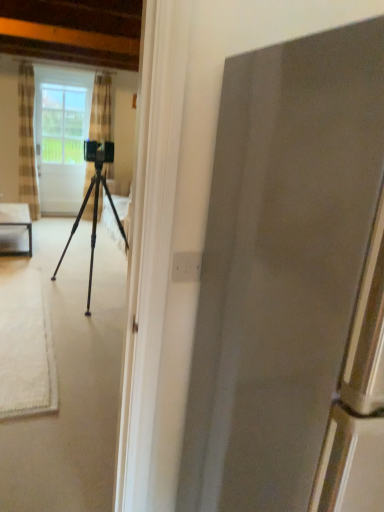
Measure the distance between point (19, 206) and camera.

Point (19, 206) and camera are 4.71 meters apart.

The height and width of the screenshot is (512, 384). Describe the element at coordinates (27, 140) in the screenshot. I see `checkered fabric curtain at left, the second curtain from the right` at that location.

The width and height of the screenshot is (384, 512). In order to click on striped fabric curtain at center, which ranks as the 1th curtain in right-to-left order in this screenshot , I will do `click(101, 109)`.

From the image's perspective, between checkered fabric curtain at left, the second curtain from the right, and clear glass table at left, who is located below?

clear glass table at left.

Consider the image. Is the surface of checkered fabric curtain at left, the 1th curtain positioned from the left, in direct contact with clear glass table at left?

No, checkered fabric curtain at left, the 1th curtain positioned from the left, is not making contact with clear glass table at left.

Is checkered fabric curtain at left, the 1th curtain positioned from the left, wider or thinner than clear glass table at left?

checkered fabric curtain at left, the 1th curtain positioned from the left, is thinner than clear glass table at left.

Would you say clear glass table at left is part of checkered fabric curtain at left, the 1th curtain positioned from the left,'s contents?

Definitely not — clear glass table at left is not inside checkered fabric curtain at left, the 1th curtain positioned from the left.

In the scene shown: Who is shorter, clear glass table at left or checkered fabric curtain at left, the second curtain from the right?

clear glass table at left is shorter.

Find the location of a particular element. Image resolution: width=384 pixels, height=512 pixels. table that is below the checkered fabric curtain at left, the 1th curtain positioned from the left (from the image's perspective) is located at coordinates (16, 222).

Who is more distant, clear glass table at left or checkered fabric curtain at left, the 1th curtain positioned from the left?

checkered fabric curtain at left, the 1th curtain positioned from the left, is behind.

Is metallic tripod at center not within checkered fabric curtain at left, the second curtain from the right?

Yes, metallic tripod at center is not within checkered fabric curtain at left, the second curtain from the right.

Who is smaller, metallic tripod at center or checkered fabric curtain at left, the second curtain from the right?

checkered fabric curtain at left, the second curtain from the right.

Is metallic tripod at center to the left of checkered fabric curtain at left, the 1th curtain positioned from the left, from the viewer's perspective?

In fact, metallic tripod at center is to the right of checkered fabric curtain at left, the 1th curtain positioned from the left.

In the image, is striped fabric curtain at center, which ranks as the 1th curtain in right-to-left order, positioned in front of or behind clear glass table at left?

Clearly, striped fabric curtain at center, which ranks as the 1th curtain in right-to-left order, is behind clear glass table at left.

In order to click on the 2nd curtain behind the clear glass table at left, counting from the anchor's position in this screenshot , I will do pos(101,109).

Between striped fabric curtain at center, positioned as the second curtain in left-to-right order, and clear glass table at left, which one appears on the left side from the viewer's perspective?

From the viewer's perspective, clear glass table at left appears more on the left side.

How many degrees apart are the facing directions of striped fabric curtain at center, which ranks as the 1th curtain in right-to-left order, and clear glass table at left?

striped fabric curtain at center, which ranks as the 1th curtain in right-to-left order, and clear glass table at left are facing 1.48 degrees away from each other.

Locate an element on the screen. The image size is (384, 512). screen door behind the checkered fabric curtain at left, the 1th curtain positioned from the left is located at coordinates pos(61,137).

Does checkered fabric curtain at left, the 1th curtain positioned from the left, have a smaller size compared to clear glass screen door at upper left?

No, checkered fabric curtain at left, the 1th curtain positioned from the left, is not smaller than clear glass screen door at upper left.

Which is more to the right, checkered fabric curtain at left, the second curtain from the right, or clear glass screen door at upper left?

From the viewer's perspective, clear glass screen door at upper left appears more on the right side.

What's the angular difference between clear glass table at left and metallic tripod at center's facing directions?

8.19 degrees separate the facing orientations of clear glass table at left and metallic tripod at center.

Is clear glass table at left at the left side of metallic tripod at center?

Indeed, clear glass table at left is positioned on the left side of metallic tripod at center.

From a real-world perspective, who is located lower, clear glass table at left or metallic tripod at center?

clear glass table at left is physically lower.

The height and width of the screenshot is (512, 384). I want to click on table located behind the metallic tripod at center, so click(x=16, y=222).

Is striped fabric curtain at center, positioned as the second curtain in left-to-right order, not near checkered fabric curtain at left, the second curtain from the right?

No, there isn't a large distance between striped fabric curtain at center, positioned as the second curtain in left-to-right order, and checkered fabric curtain at left, the second curtain from the right.

Where is `curtain above the striped fabric curtain at center, positioned as the second curtain in left-to-right order (from the image's perspective)`? curtain above the striped fabric curtain at center, positioned as the second curtain in left-to-right order (from the image's perspective) is located at coordinates (27, 140).

Consider the image. From a real-world perspective, between striped fabric curtain at center, which ranks as the 1th curtain in right-to-left order, and checkered fabric curtain at left, the 1th curtain positioned from the left, who is vertically higher?

In real-world perspective, checkered fabric curtain at left, the 1th curtain positioned from the left, is above.

Considering the sizes of objects striped fabric curtain at center, which ranks as the 1th curtain in right-to-left order, and checkered fabric curtain at left, the second curtain from the right, in the image provided, who is thinner, striped fabric curtain at center, which ranks as the 1th curtain in right-to-left order, or checkered fabric curtain at left, the second curtain from the right,?

Thinner between the two is striped fabric curtain at center, which ranks as the 1th curtain in right-to-left order.

From the clear glass table at left, count 1st curtains backward and point to it. Please provide its 2D coordinates.

[(27, 140)]

At what (x,y) coordinates should I click in order to perform the action: click on curtain that is the 2nd one above the clear glass table at left (from a real-world perspective). Please return your answer as a coordinate pair (x, y). Looking at the image, I should click on (27, 140).

Which object lies nearer to the anchor point checkered fabric curtain at left, the second curtain from the right, striped fabric curtain at center, which ranks as the 1th curtain in right-to-left order, or clear glass table at left?

striped fabric curtain at center, which ranks as the 1th curtain in right-to-left order.

Which object lies further to the anchor point clear glass screen door at upper left, striped fabric curtain at center, which ranks as the 1th curtain in right-to-left order, or clear glass table at left?

The object further to clear glass screen door at upper left is clear glass table at left.

Looking at the image, which one is located further to checkered fabric curtain at left, the 1th curtain positioned from the left, clear glass table at left or striped fabric curtain at center, which ranks as the 1th curtain in right-to-left order?

Among the two, clear glass table at left is located further to checkered fabric curtain at left, the 1th curtain positioned from the left.

In the scene shown: Which object lies nearer to the anchor point clear glass table at left, metallic tripod at center or checkered fabric curtain at left, the 1th curtain positioned from the left?

metallic tripod at center is closer to clear glass table at left.

Which object lies nearer to the anchor point striped fabric curtain at center, which ranks as the 1th curtain in right-to-left order, checkered fabric curtain at left, the second curtain from the right, or clear glass screen door at upper left?

clear glass screen door at upper left is positioned closer to the anchor striped fabric curtain at center, which ranks as the 1th curtain in right-to-left order.

When comparing their distances from clear glass screen door at upper left, does checkered fabric curtain at left, the second curtain from the right, or metallic tripod at center seem closer?

checkered fabric curtain at left, the second curtain from the right, lies closer to clear glass screen door at upper left than the other object.

Which object lies nearer to the anchor point clear glass screen door at upper left, clear glass table at left or striped fabric curtain at center, positioned as the second curtain in left-to-right order?

Among the two, striped fabric curtain at center, positioned as the second curtain in left-to-right order, is located nearer to clear glass screen door at upper left.

Looking at the image, which one is located closer to clear glass screen door at upper left, striped fabric curtain at center, positioned as the second curtain in left-to-right order, or metallic tripod at center?

striped fabric curtain at center, positioned as the second curtain in left-to-right order.

Where is `table between metallic tripod at center and striped fabric curtain at center, which ranks as the 1th curtain in right-to-left order, in the front-back direction`? table between metallic tripod at center and striped fabric curtain at center, which ranks as the 1th curtain in right-to-left order, in the front-back direction is located at coordinates (16, 222).

The width and height of the screenshot is (384, 512). What are the coordinates of `screen door between clear glass table at left and striped fabric curtain at center, positioned as the second curtain in left-to-right order, in the front-back direction` in the screenshot? It's located at (61, 137).

Locate an element on the screen. The width and height of the screenshot is (384, 512). curtain between clear glass table at left and clear glass screen door at upper left from front to back is located at coordinates (27, 140).

In order to click on curtain located between clear glass table at left and striped fabric curtain at center, which ranks as the 1th curtain in right-to-left order, in the depth direction in this screenshot , I will do `click(27, 140)`.